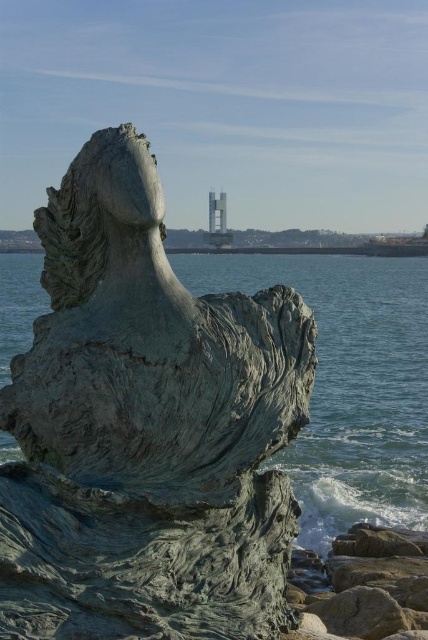
Question: Can you confirm if bronze sculpture at center is thinner than rough stone rock at lower right?

Choices:
 (A) yes
 (B) no

Answer: (A)

Question: Can you confirm if bronze sculpture at center is thinner than rough stone rock at lower right?

Choices:
 (A) yes
 (B) no

Answer: (A)

Question: In this image, where is bronze sculpture at center located relative to rough stone rock at lower right?

Choices:
 (A) left
 (B) right

Answer: (A)